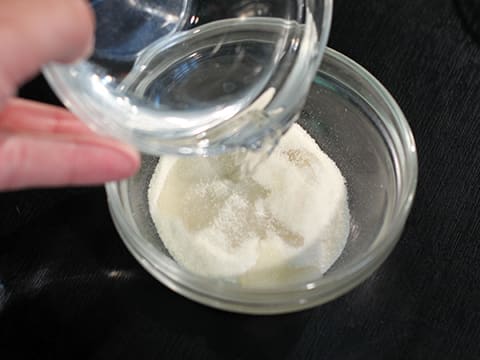
Find the location of a particular element. The width and height of the screenshot is (480, 360). rim of bowl is located at coordinates (327, 25), (414, 166).